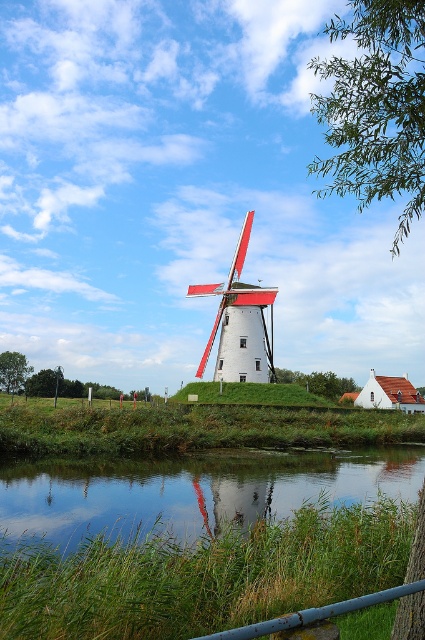
Question: Does transparent water at lower center have a larger size compared to green leafy tree at center?

Choices:
 (A) yes
 (B) no

Answer: (B)

Question: Which object appears farthest from the camera in this image?

Choices:
 (A) white matte windmill at center
 (B) green leafy tree at lower left
 (C) green leafy tree at center
 (D) transparent water at lower center

Answer: (B)

Question: Among these points, which one is farthest from the camera?

Choices:
 (A) (331, 396)
 (B) (231, 502)
 (C) (5, 374)
 (D) (221, 305)

Answer: (C)

Question: Among these objects, which one is farthest from the camera?

Choices:
 (A) green leafy tree at center
 (B) green leafy tree at lower left
 (C) green leafy tree at upper right

Answer: (B)

Question: Is transparent water at lower center wider than green leafy tree at center?

Choices:
 (A) no
 (B) yes

Answer: (B)

Question: Is transparent water at lower center to the left of green leafy tree at center from the viewer's perspective?

Choices:
 (A) no
 (B) yes

Answer: (B)